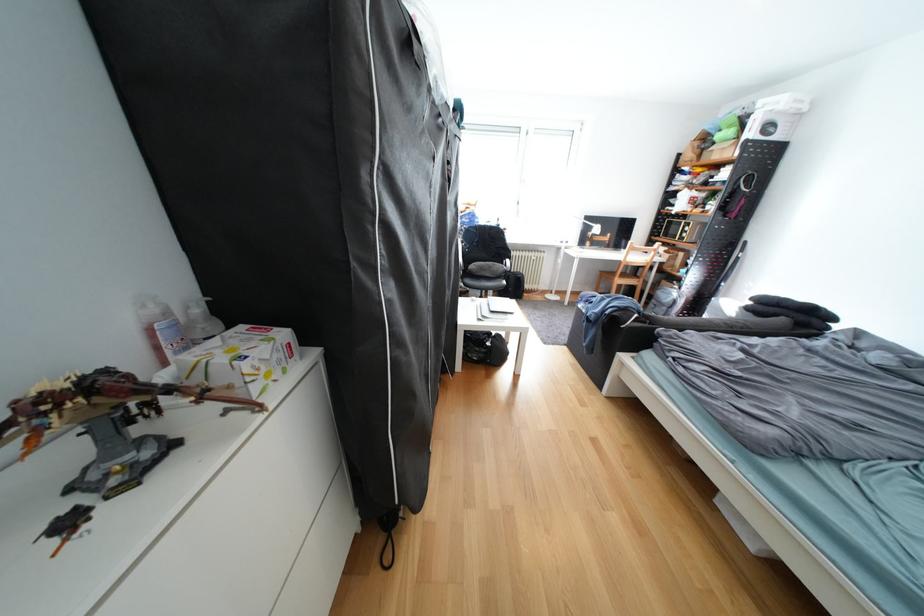
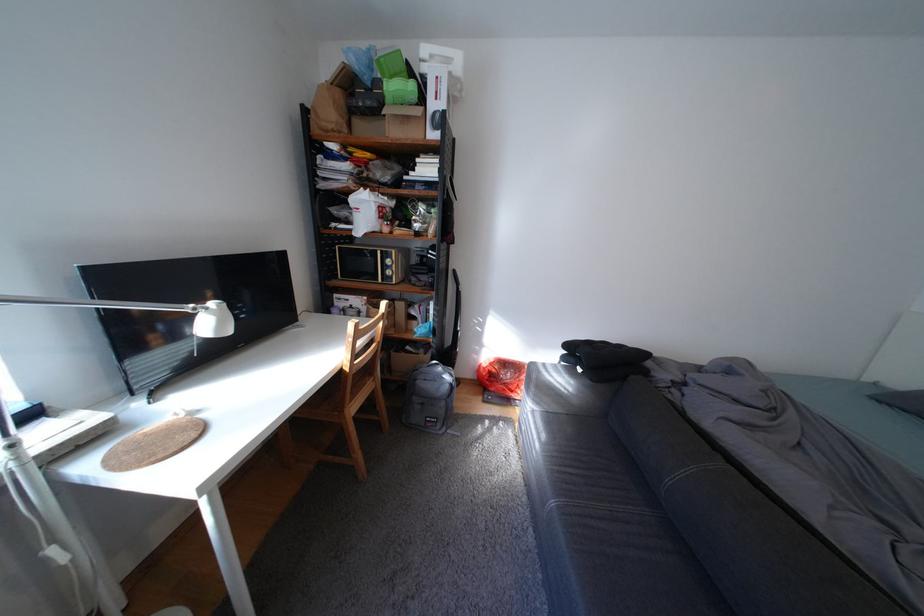
The point at (x=710, y=145) is marked in the first image. Where is the corresponding point in the second image?

(351, 95)